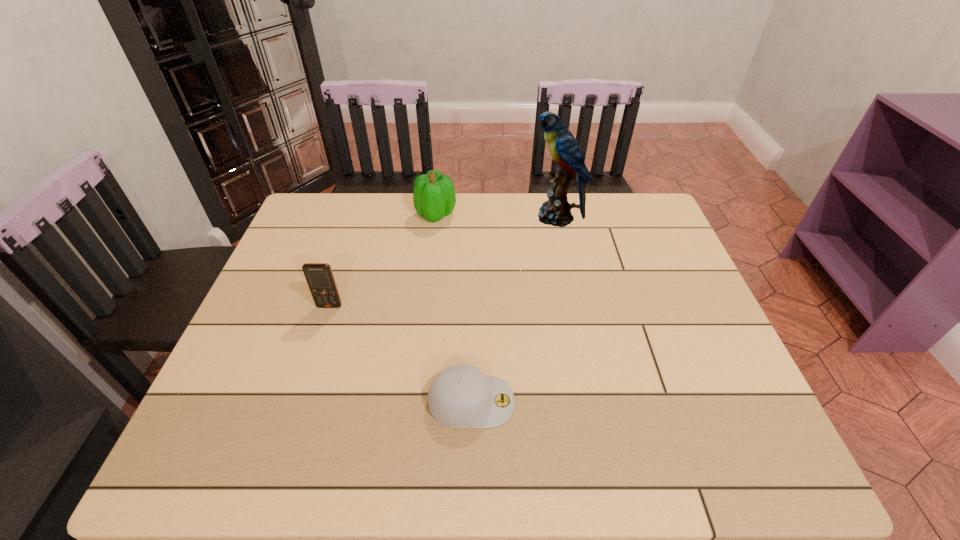
Where is `free space between the leftmost object and the cap`? The height and width of the screenshot is (540, 960). free space between the leftmost object and the cap is located at coordinates (400, 354).

Find the location of a particular element. free spot between the shortest object and the rightmost object is located at coordinates (514, 309).

What are the coordinates of `vacant space in between the bell pepper and the shortest object` in the screenshot? It's located at (454, 308).

Identify which object is the third closest to the nearest object. Please provide its 2D coordinates. Your answer should be formatted as a tuple, i.e. [(x, y)], where the tuple contains the x and y coordinates of a point satisfying the conditions above.

[(434, 197)]

Identify which object is the third closest to the bell pepper. Please provide its 2D coordinates. Your answer should be formatted as a tuple, i.e. [(x, y)], where the tuple contains the x and y coordinates of a point satisfying the conditions above.

[(461, 396)]

Where is `free location that satisfies the following two spatial constraints: 1. on the face of the rightmost object; 2. on the screen of the cellular telephone`? The width and height of the screenshot is (960, 540). free location that satisfies the following two spatial constraints: 1. on the face of the rightmost object; 2. on the screen of the cellular telephone is located at coordinates 575,306.

The width and height of the screenshot is (960, 540). Find the location of `vacant position in the image that satisfies the following two spatial constraints: 1. on the face of the rightmost object; 2. on the screen of the leftmost object`. vacant position in the image that satisfies the following two spatial constraints: 1. on the face of the rightmost object; 2. on the screen of the leftmost object is located at coordinates (575, 306).

This screenshot has width=960, height=540. I want to click on free region that satisfies the following two spatial constraints: 1. on the face of the tallest object; 2. on the screen of the third farthest object, so click(575, 306).